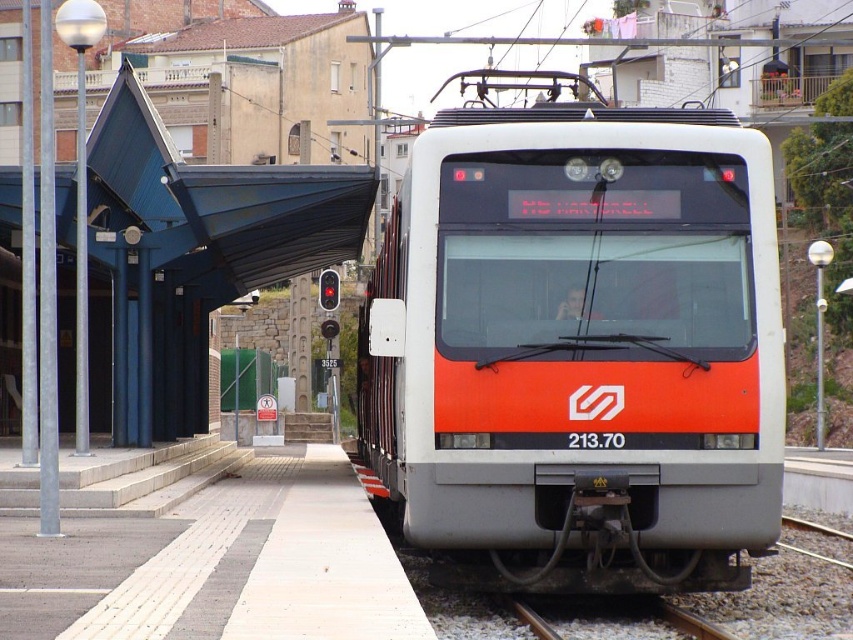
Question: Does orange glossy train at center come behind brown gravel train track at lower center?

Choices:
 (A) no
 (B) yes

Answer: (A)

Question: Which of the following is the closest to the observer?

Choices:
 (A) orange glossy train at center
 (B) brown gravel train track at lower center

Answer: (A)

Question: Which of the following is the closest to the observer?

Choices:
 (A) orange glossy train at center
 (B) brown gravel train track at lower center

Answer: (A)

Question: Does orange glossy train at center appear on the left side of brown gravel train track at lower center?

Choices:
 (A) yes
 (B) no

Answer: (A)

Question: Is orange glossy train at center smaller than brown gravel train track at lower center?

Choices:
 (A) no
 (B) yes

Answer: (A)